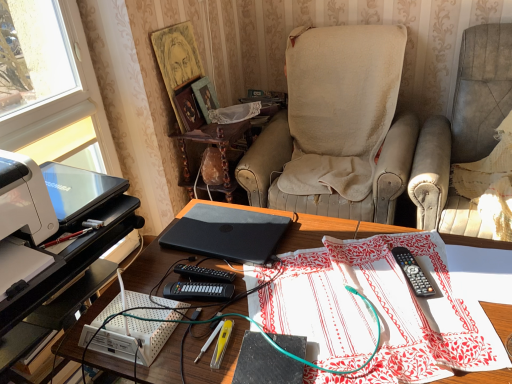
In order to click on free space to the back side of black plastic remote control at center, acting as the 2th stationery starting from the left in this screenshot , I will do `click(385, 243)`.